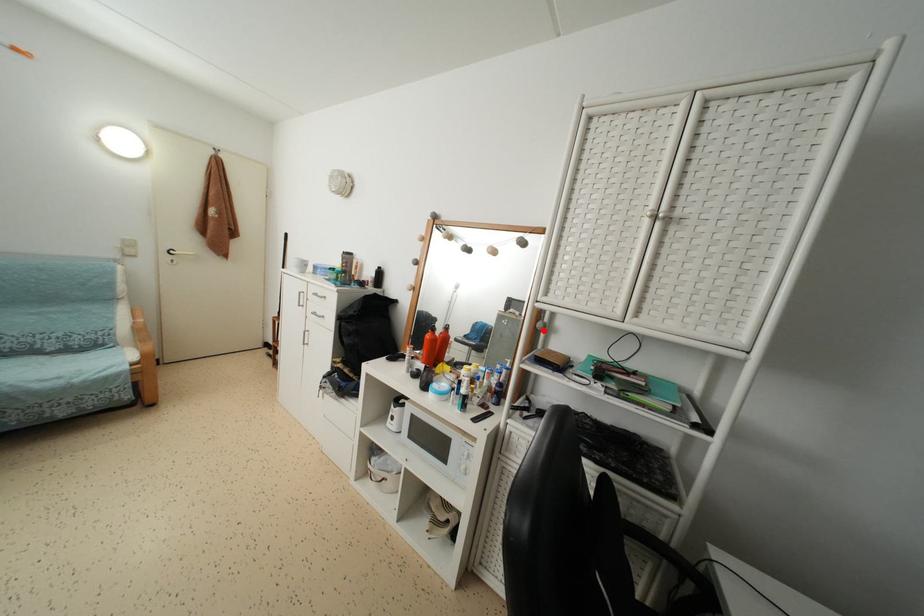
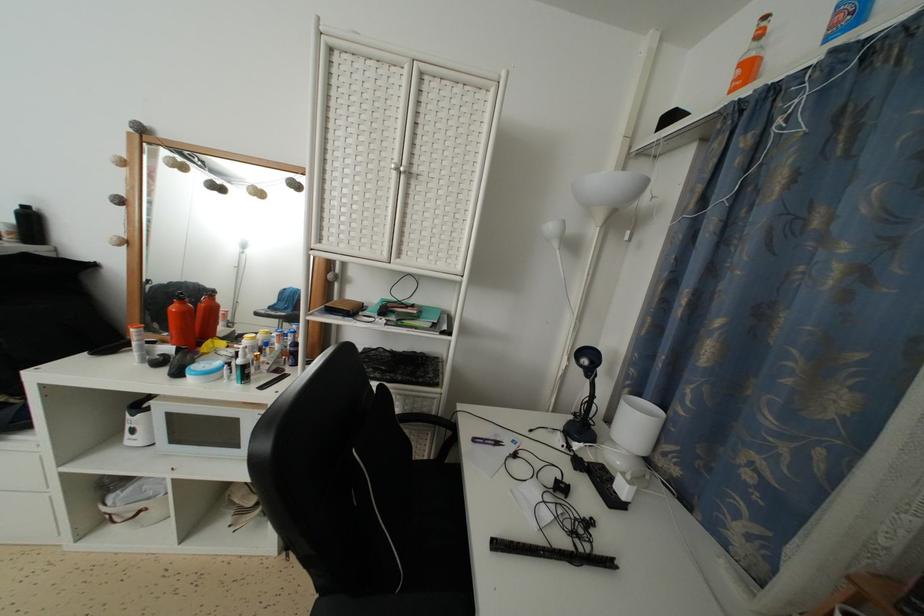
Locate, in the second image, the point that corresponds to the highlighted location in the first image.

(334, 282)